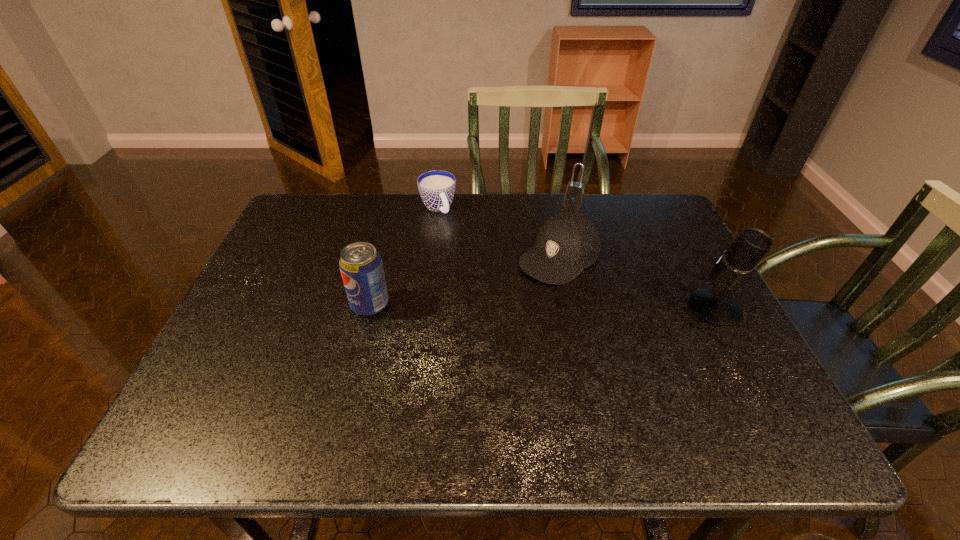
This screenshot has height=540, width=960. Identify the location of vacant space that's between the padlock and the leftmost object. (472, 252).

What are the coordinates of `vacant point located between the tallest object and the padlock` in the screenshot? It's located at (644, 253).

I want to click on vacant space that is in between the padlock and the fourth object from right to left, so click(506, 204).

Identify the location of vacant point located between the padlock and the microphone. (644, 253).

The width and height of the screenshot is (960, 540). I want to click on free space between the fourth shortest object and the shortest object, so click(x=404, y=256).

Locate an element on the screen. The image size is (960, 540). vacant point located between the cap and the microphone is located at coordinates (637, 282).

This screenshot has width=960, height=540. Find the location of `vacant point located between the fourth shortest object and the padlock`. vacant point located between the fourth shortest object and the padlock is located at coordinates pos(472,252).

Select which object appears as the fourth closest to the rightmost object. Please provide its 2D coordinates. Your answer should be formatted as a tuple, i.e. [(x, y)], where the tuple contains the x and y coordinates of a point satisfying the conditions above.

[(361, 267)]

Identify which object is the fourth closest to the third nearest object. Please provide its 2D coordinates. Your answer should be formatted as a tuple, i.e. [(x, y)], where the tuple contains the x and y coordinates of a point satisfying the conditions above.

[(361, 267)]

This screenshot has width=960, height=540. What are the coordinates of `free space that satisfies the following two spatial constraints: 1. on the back side of the padlock; 2. on the right side of the fourth shortest object` in the screenshot? It's located at (396, 199).